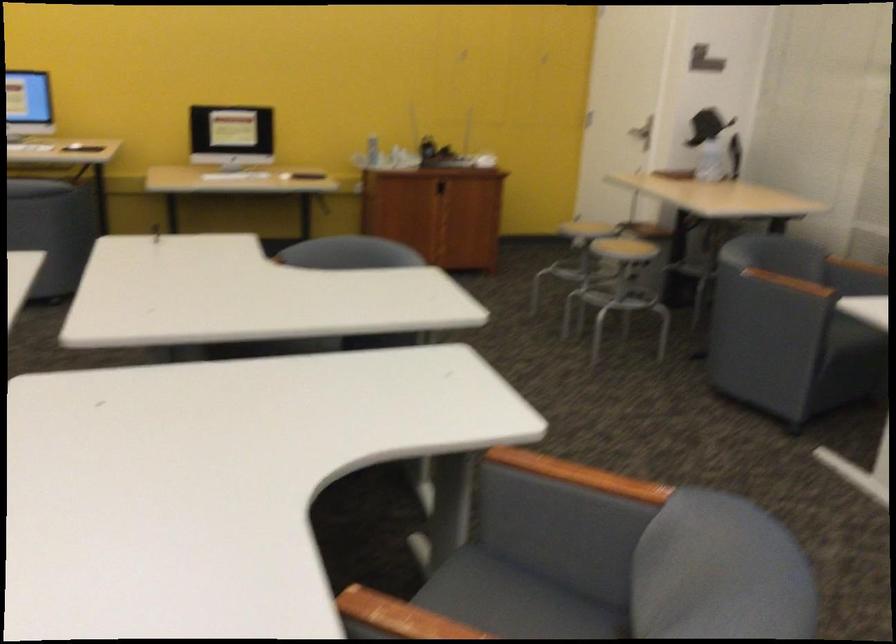
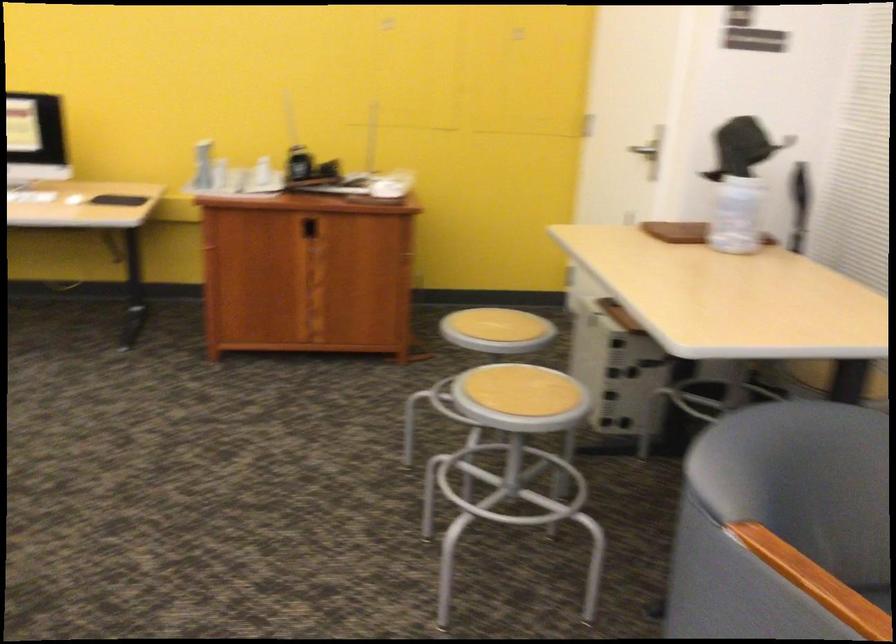
What movement of the cameraman would produce the second image?

The cameraman walked toward right, forward.